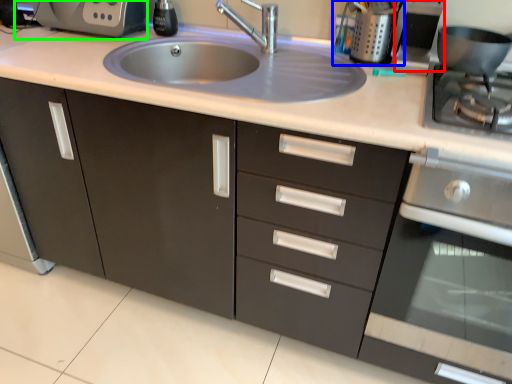
Question: Which object is the closest to the appliance (highlighted by a red box)? Choose among these: appliance (highlighted by a blue box) or coffee machine (highlighted by a green box).

Choices:
 (A) appliance
 (B) coffee machine

Answer: (A)